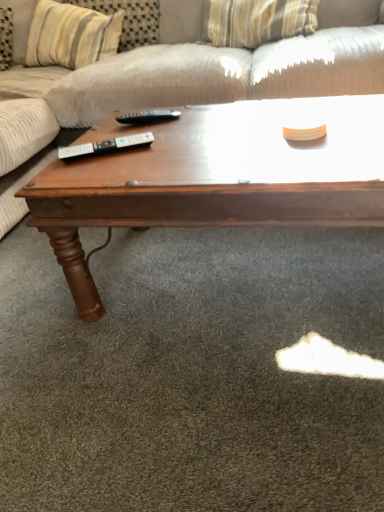
I want to click on vacant space in front of black plastic remote at center, the 2th remote when ordered from front to back, so click(x=177, y=142).